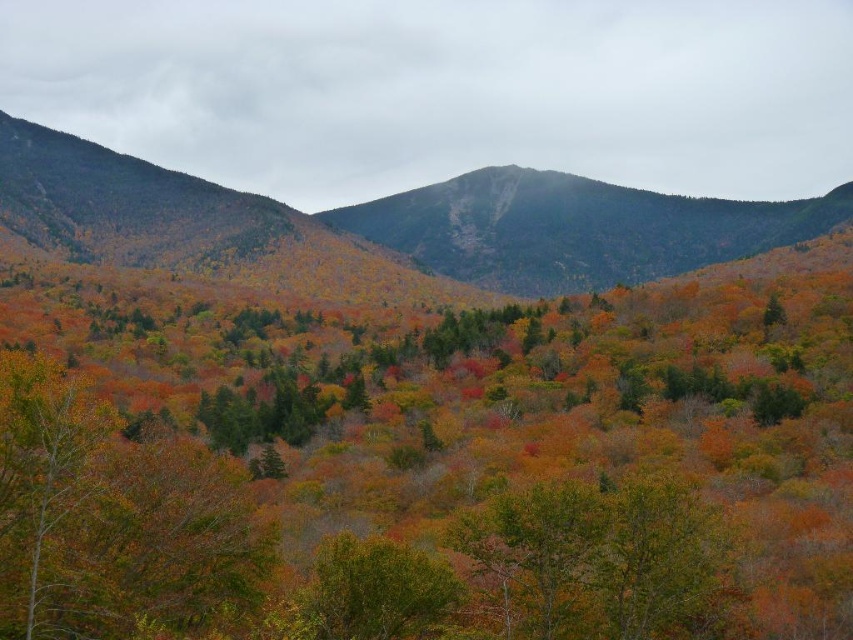
Which is behind, point (90, 426) or point (363, 628)?

Positioned behind is point (363, 628).

Does green matte tree at lower left have a larger size compared to green matte tree at center?

Indeed, green matte tree at lower left has a larger size compared to green matte tree at center.

What do you see at coordinates (112, 518) in the screenshot? I see `green matte tree at lower left` at bounding box center [112, 518].

Locate an element on the screen. The height and width of the screenshot is (640, 853). green matte tree at lower left is located at coordinates (112, 518).

Consider the image. Between autumn leaves at center and green matte tree at center, which one has more height?

With more height is autumn leaves at center.

Locate an element on the screen. autumn leaves at center is located at coordinates (509, 401).

Is green matte tree at lower left behind smooth gray rock at center?

No, it is not.

Is green matte tree at lower left shorter than smooth gray rock at center?

Correct, green matte tree at lower left is not as tall as smooth gray rock at center.

Find the location of a particular element. green matte tree at lower left is located at coordinates coord(112,518).